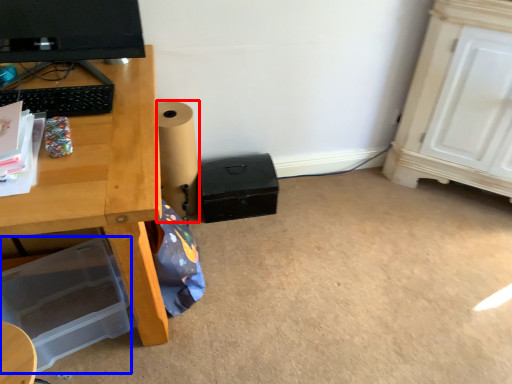
Question: Which object is further to the camera taking this photo, speaker (highlighted by a red box) or box (highlighted by a blue box)?

Choices:
 (A) speaker
 (B) box

Answer: (A)